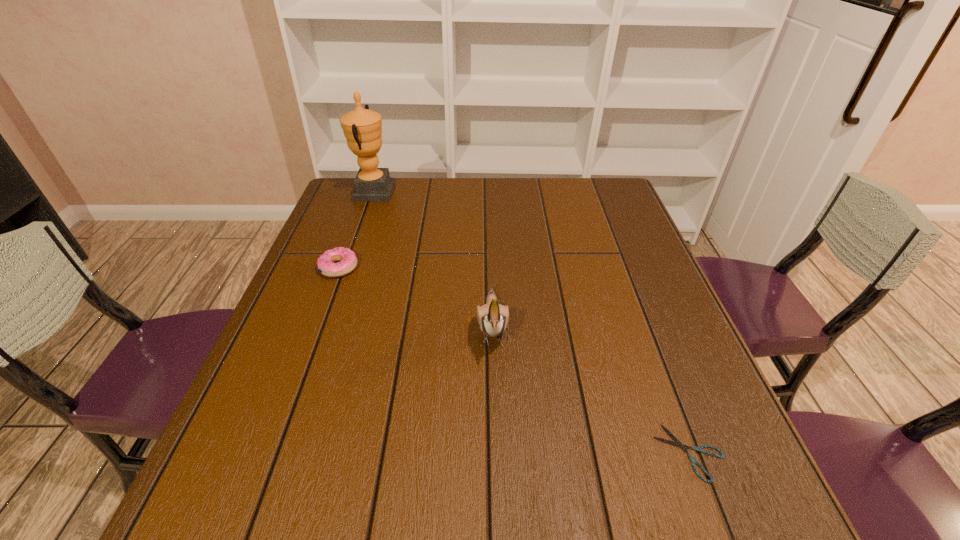
The width and height of the screenshot is (960, 540). In order to click on award in this screenshot , I will do `click(362, 128)`.

Locate an element on the screen. This screenshot has width=960, height=540. the tallest object is located at coordinates (362, 128).

Where is `the third farthest object`? The image size is (960, 540). the third farthest object is located at coordinates tap(492, 318).

Find the location of a particular element. the second tallest object is located at coordinates (492, 318).

In order to click on the second farthest object in this screenshot , I will do `click(347, 259)`.

At what (x,y) coordinates should I click in order to perform the action: click on the third tallest object. Please return your answer as a coordinate pair (x, y). This screenshot has height=540, width=960. Looking at the image, I should click on (347, 259).

Image resolution: width=960 pixels, height=540 pixels. I want to click on shears, so click(x=677, y=443).

Where is `the nearest object`? Image resolution: width=960 pixels, height=540 pixels. the nearest object is located at coordinates (677, 443).

This screenshot has height=540, width=960. In order to click on vacant space positioned 0.080m at the front of the farthest object with handles in this screenshot , I will do `click(417, 192)`.

Locate an element on the screen. free spot located 0.090m at the face of the second tallest object is located at coordinates (494, 409).